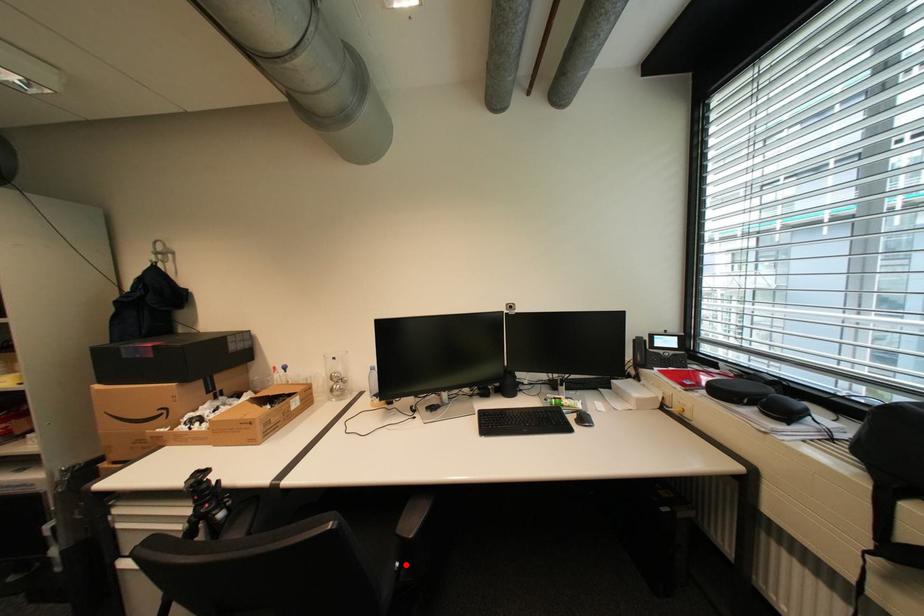
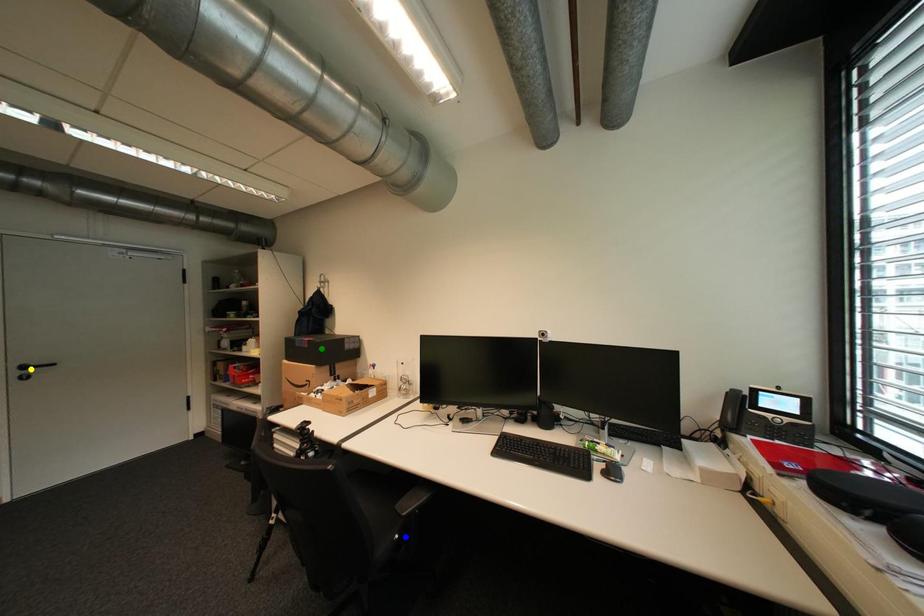
Question: I am providing you with two images of the same scene from different viewpoints. A red point is marked on the first image. You are given multiple points on the second image. Which mark in image 2 goes with the point in image 1?

Choices:
 (A) yellow point
 (B) green point
 (C) blue point

Answer: (C)